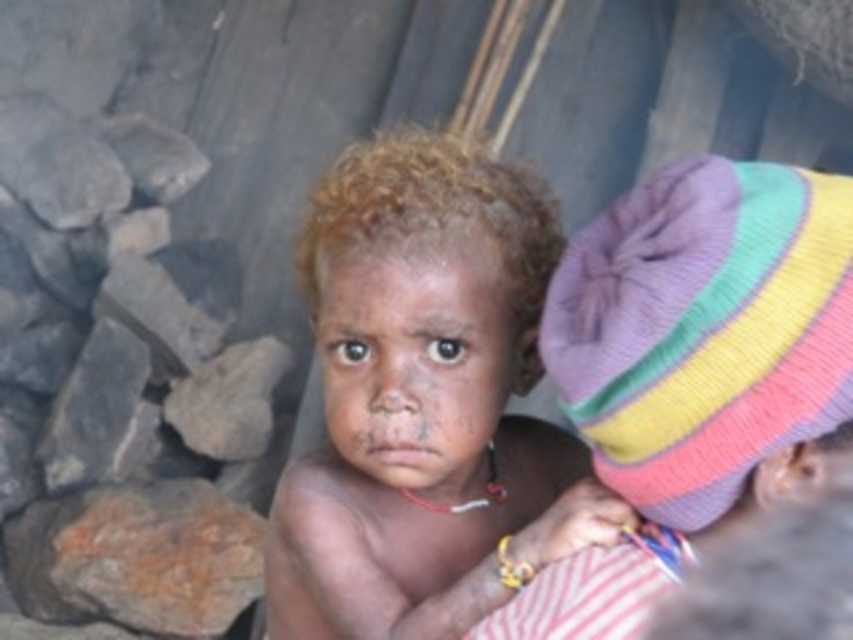
Question: Which of the following is the closest to the observer?

Choices:
 (A) (335, 228)
 (B) (314, 326)

Answer: (A)

Question: Can you confirm if dark skin child at center is positioned to the right of dark skin face at center?

Choices:
 (A) yes
 (B) no

Answer: (A)

Question: Can you confirm if dark skin child at center is positioned to the left of dark skin face at center?

Choices:
 (A) no
 (B) yes

Answer: (A)

Question: Among these points, which one is nearest to the camera?

Choices:
 (A) (445, 461)
 (B) (370, 282)
 (C) (573, 385)

Answer: (C)

Question: Does dark skin child at center appear under dark skin face at center?

Choices:
 (A) no
 (B) yes

Answer: (B)

Question: Among these points, which one is farthest from the camera?

Choices:
 (A) (708, 422)
 (B) (369, 340)

Answer: (B)